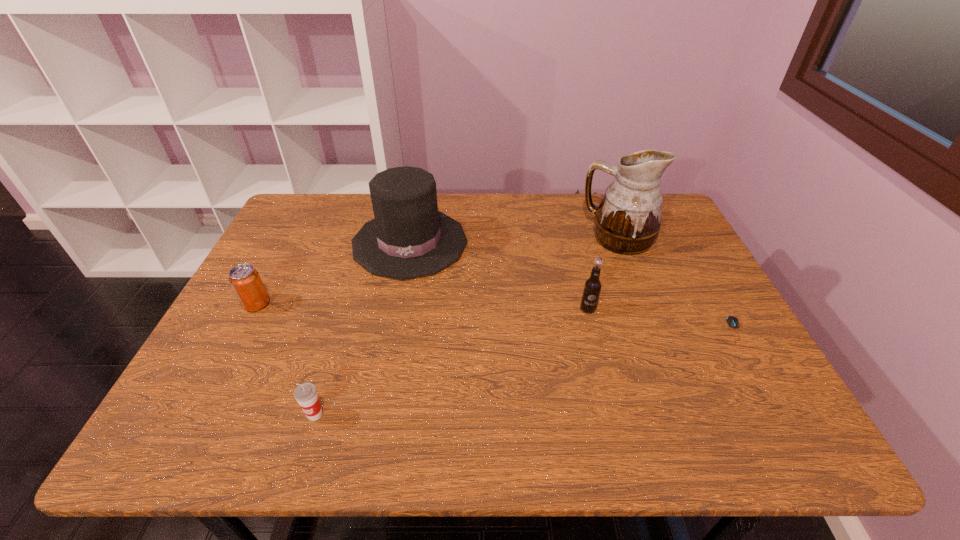
You are a GUI agent. You are given a task and a screenshot of the screen. Output one action in this format:
    pyautogui.click(x=<x>, y=<y>)
    Task: Click on the tallest object
    This screenshot has width=960, height=540.
    Given the screenshot: What is the action you would take?
    click(x=628, y=218)

Find the location of a particular element. the second object from right to left is located at coordinates (628, 218).

At what (x,y) coordinates should I click in order to perform the action: click on dress hat. Please return your answer as a coordinate pair (x, y). This screenshot has width=960, height=540. Looking at the image, I should click on (408, 238).

In order to click on the fourth shortest object in this screenshot , I will do `click(592, 287)`.

Find the location of `the third object from right to left`. the third object from right to left is located at coordinates (592, 287).

In order to click on the leftmost object in this screenshot , I will do `click(244, 279)`.

At what (x,y) coordinates should I click in order to perform the action: click on cup. Please return your answer as a coordinate pair (x, y). This screenshot has height=540, width=960. Looking at the image, I should click on (306, 395).

Locate an element on the screen. the shortest object is located at coordinates (732, 321).

Where is `the rightmost object`? Image resolution: width=960 pixels, height=540 pixels. the rightmost object is located at coordinates (732, 321).

The image size is (960, 540). I want to click on free space located 0.150m from the spout of the tallest object, so click(x=533, y=238).